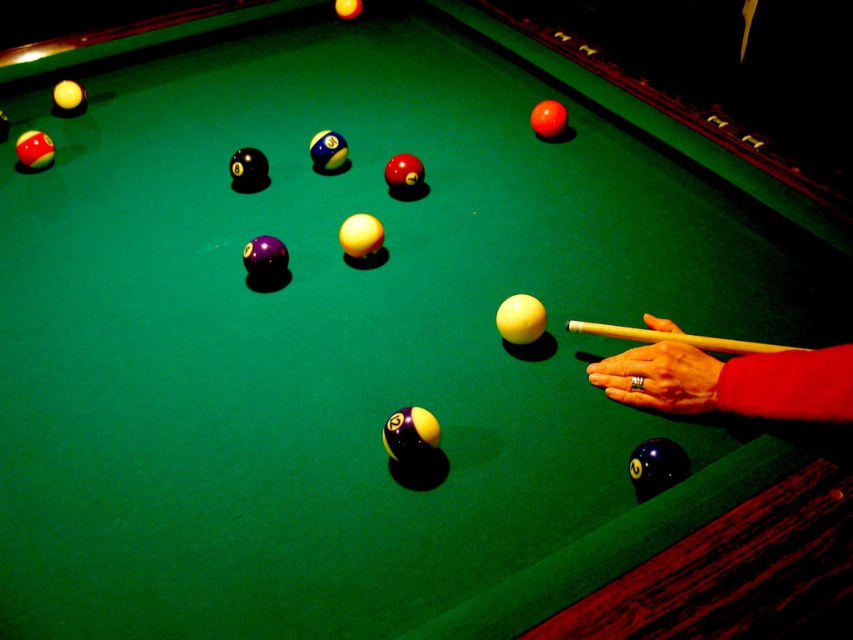
Describe the element at coordinates (730, 381) in the screenshot. This screenshot has width=853, height=640. I see `smooth yellow cue stick at lower right` at that location.

Who is positioned more to the right, smooth yellow cue stick at lower right or yellow wood cue at center?

From the viewer's perspective, yellow wood cue at center appears more on the right side.

Identify the location of smooth yellow cue stick at lower right. (730, 381).

How much distance is there between smooth yellow cue stick at lower right and gold ring at lower right?

They are 1.08 inches apart.

Can you confirm if smooth yellow cue stick at lower right is positioned to the right of gold ring at lower right?

Correct, you'll find smooth yellow cue stick at lower right to the right of gold ring at lower right.

This screenshot has width=853, height=640. What do you see at coordinates (730, 381) in the screenshot?
I see `smooth yellow cue stick at lower right` at bounding box center [730, 381].

Find the location of a particular element. The image size is (853, 640). smooth yellow cue stick at lower right is located at coordinates (730, 381).

In the scene shown: Is gold ring at lower right taller than yellow wood cue at center?

Yes.

This screenshot has width=853, height=640. What do you see at coordinates (659, 378) in the screenshot?
I see `gold ring at lower right` at bounding box center [659, 378].

Is point (663, 387) in front of point (672, 339)?

Yes, point (663, 387) is closer to viewer.

Image resolution: width=853 pixels, height=640 pixels. In order to click on gold ring at lower right in this screenshot , I will do `click(659, 378)`.